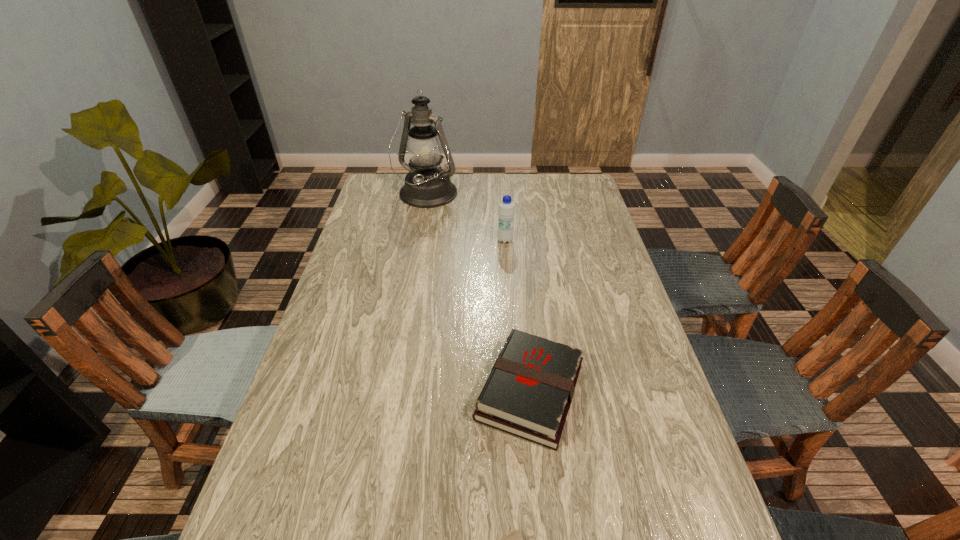
Locate an element on the screen. This screenshot has height=540, width=960. object at the left edge is located at coordinates (426, 186).

In order to click on object positioned at the far left corner in this screenshot , I will do `click(426, 186)`.

The image size is (960, 540). Find the location of `vacant space at the far edge of the desktop`. vacant space at the far edge of the desktop is located at coordinates (468, 188).

What are the coordinates of `vacant space at the left edge` in the screenshot? It's located at (396, 211).

This screenshot has width=960, height=540. Identify the location of vacant space at the right edge. (626, 294).

In the image, there is a desktop. Where is `vacant space at the far right corner`? The height and width of the screenshot is (540, 960). vacant space at the far right corner is located at coordinates (566, 201).

Where is `blank region between the tallest object and the water bottle`? blank region between the tallest object and the water bottle is located at coordinates (466, 218).

Where is `empty location between the leftmost object and the third nearest object`? The height and width of the screenshot is (540, 960). empty location between the leftmost object and the third nearest object is located at coordinates (466, 218).

Locate an element on the screen. object that stands as the third closest to the leftmost object is located at coordinates 514,539.

Locate an element on the screen. This screenshot has width=960, height=540. object that is the closest one to the tallest object is located at coordinates (506, 211).